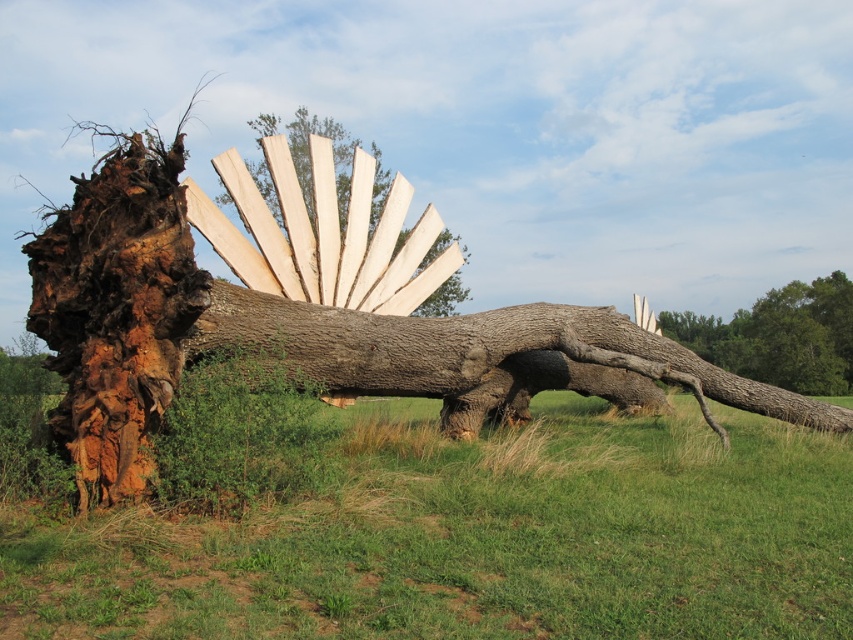
Question: Does rustic wood sculpture at left have a larger size compared to natural wood fan at center?

Choices:
 (A) yes
 (B) no

Answer: (A)

Question: Among these objects, which one is nearest to the camera?

Choices:
 (A) green grass at lower left
 (B) smooth bark tree trunk at right
 (C) rustic wood sculpture at left

Answer: (C)

Question: Which object is positioned closest to the natural wood fan at center?

Choices:
 (A) smooth bark tree trunk at right
 (B) green grass at lower left

Answer: (B)

Question: Is smooth bark tree trunk at right to the right of natural wood fan at center from the viewer's perspective?

Choices:
 (A) no
 (B) yes

Answer: (B)

Question: Which point is closer to the camera?

Choices:
 (A) green grass at lower left
 (B) rustic wood sculpture at left
 (C) natural wood fan at center
 (D) smooth bark tree trunk at right

Answer: (B)

Question: Is rustic wood sculpture at left below natural wood fan at center?

Choices:
 (A) yes
 (B) no

Answer: (A)